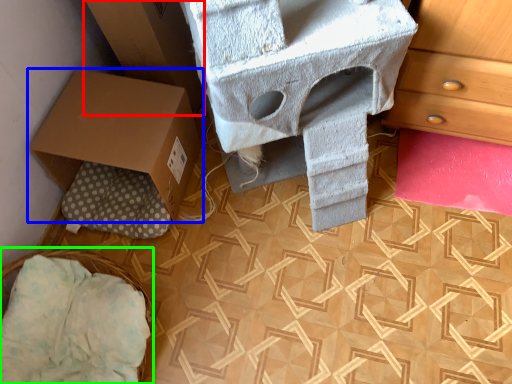
Question: Which is nearer to the cardboard box (highlighted by a red box)? box (highlighted by a blue box) or basket (highlighted by a green box).

Choices:
 (A) box
 (B) basket

Answer: (A)